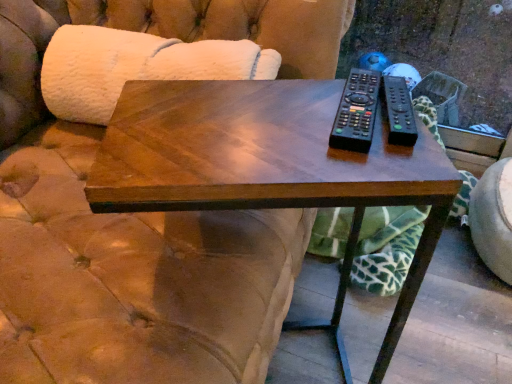
Question: From a real-world perspective, is black plastic remote at right, the first remote viewed from the right, positioned under shiny wood coffee table at center based on gravity?

Choices:
 (A) no
 (B) yes

Answer: (A)

Question: From a real-world perspective, is black plastic remote at right, marked as the second remote in a left-to-right arrangement, over shiny wood coffee table at center?

Choices:
 (A) no
 (B) yes

Answer: (B)

Question: Is the surface of black plastic remote at right, the first remote viewed from the right, in direct contact with shiny wood coffee table at center?

Choices:
 (A) yes
 (B) no

Answer: (B)

Question: Is black plastic remote at right, marked as the second remote in a left-to-right arrangement, taller than shiny wood coffee table at center?

Choices:
 (A) no
 (B) yes

Answer: (A)

Question: Can you confirm if black plastic remote at right, marked as the second remote in a left-to-right arrangement, is shorter than shiny wood coffee table at center?

Choices:
 (A) no
 (B) yes

Answer: (B)

Question: Is black plastic remote at right, the first remote viewed from the right, bigger than shiny wood coffee table at center?

Choices:
 (A) no
 (B) yes

Answer: (A)

Question: From a real-world perspective, is black plastic remote at upper right, the 1th remote from the left, under white fluffy couch at upper left?

Choices:
 (A) yes
 (B) no

Answer: (B)

Question: Is black plastic remote at upper right, positioned as the second remote in right-to-left order, not within white fluffy couch at upper left?

Choices:
 (A) yes
 (B) no

Answer: (A)

Question: Does black plastic remote at upper right, positioned as the second remote in right-to-left order, have a greater width compared to white fluffy couch at upper left?

Choices:
 (A) yes
 (B) no

Answer: (A)

Question: Is white fluffy couch at upper left at the back of black plastic remote at upper right, positioned as the second remote in right-to-left order?

Choices:
 (A) no
 (B) yes

Answer: (A)

Question: Is black plastic remote at upper right, the 1th remote from the left, to the right of white fluffy couch at upper left from the viewer's perspective?

Choices:
 (A) no
 (B) yes

Answer: (B)

Question: Would you consider black plastic remote at upper right, positioned as the second remote in right-to-left order, to be distant from white fluffy couch at upper left?

Choices:
 (A) yes
 (B) no

Answer: (B)

Question: Can you confirm if black plastic remote at upper right, the 1th remote from the left, is bigger than shiny wood coffee table at center?

Choices:
 (A) yes
 (B) no

Answer: (B)